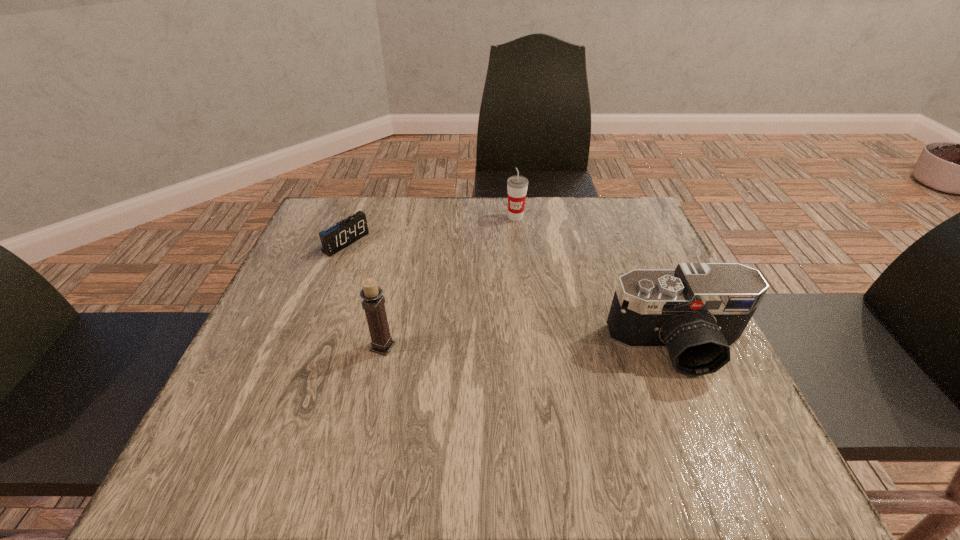
Identify the location of vacant region at the near edge. Image resolution: width=960 pixels, height=540 pixels. (359, 387).

At what (x,y) coordinates should I click in order to perform the action: click on free space at the left edge of the desktop. Please return your answer as a coordinate pair (x, y). Looking at the image, I should click on (291, 303).

Identify the location of free space at the far left corner of the desktop. (317, 215).

The height and width of the screenshot is (540, 960). Identify the location of vacant space at the near left corner. (208, 420).

Where is `blank space at the far right corner of the desktop`? This screenshot has height=540, width=960. blank space at the far right corner of the desktop is located at coordinates (583, 204).

You are a GUI agent. You are given a task and a screenshot of the screen. Output one action in this format:
    pyautogui.click(x=<x>, y=<y>)
    Task: Click on the empty space that is in between the cup and the candle holder
    
    Given the screenshot: What is the action you would take?
    pyautogui.click(x=449, y=282)

Locate an element on the screen. The width and height of the screenshot is (960, 540). free spot between the rightmost object and the cup is located at coordinates (596, 282).

Where is `free space between the rightmost object and the candle holder`? The image size is (960, 540). free space between the rightmost object and the candle holder is located at coordinates (530, 347).

The height and width of the screenshot is (540, 960). In order to click on vacant point located between the rightmost object and the second object from left to right in this screenshot , I will do `click(530, 347)`.

This screenshot has height=540, width=960. Identify the location of unoccupied area between the shortest object and the cup. (431, 230).